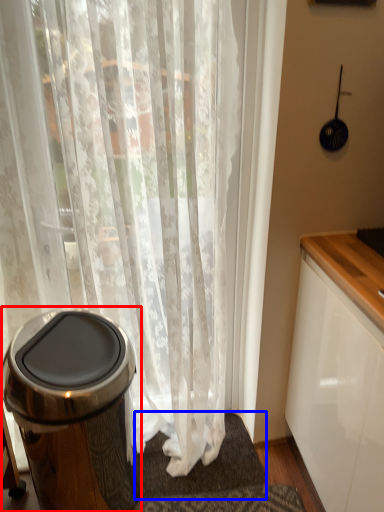
Question: Which object is further to the camera taking this photo, waste container (highlighted by a red box) or bath mat (highlighted by a blue box)?

Choices:
 (A) waste container
 (B) bath mat

Answer: (B)